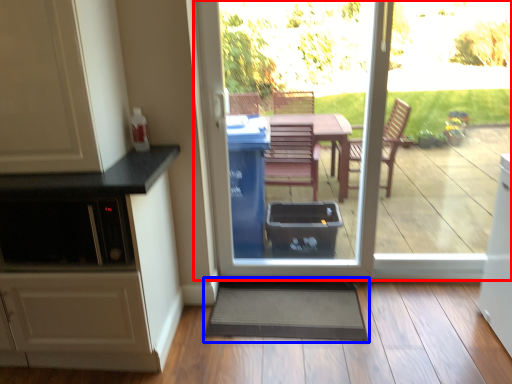
Question: Which of the following is the closest to the observer, door (highlighted by a red box) or doormat (highlighted by a blue box)?

Choices:
 (A) door
 (B) doormat

Answer: (A)